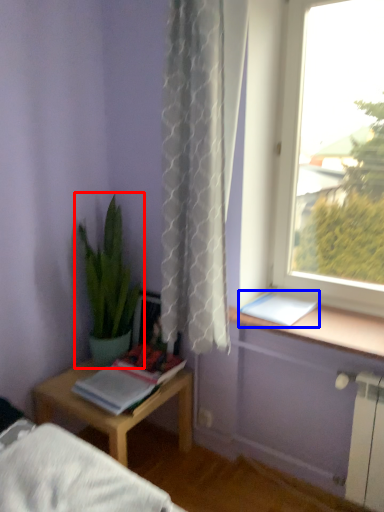
Question: Among these objects, which one is farthest to the camera, houseplant (highlighted by a red box) or book (highlighted by a blue box)?

Choices:
 (A) houseplant
 (B) book

Answer: (A)